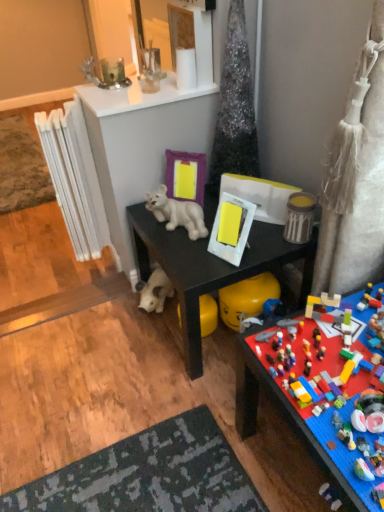
Question: In which direction should I rotate to look at sparkly silver christmas tree at upper center?

Choices:
 (A) left
 (B) right

Answer: (B)

Question: Does sparkly silver christmas tree at upper center have a greater width compared to metallic silver canister at upper right, positioned as the 4th toy in top-to-bottom order?

Choices:
 (A) no
 (B) yes

Answer: (B)

Question: Is sparkly silver christmas tree at upper center beside metallic silver canister at upper right, positioned as the 4th toy in top-to-bottom order?

Choices:
 (A) yes
 (B) no

Answer: (B)

Question: Can you confirm if sparkly silver christmas tree at upper center is positioned to the left of metallic silver canister at upper right, acting as the 3th toy starting from the bottom?

Choices:
 (A) no
 (B) yes

Answer: (B)

Question: Can you confirm if sparkly silver christmas tree at upper center is thinner than metallic silver canister at upper right, acting as the 3th toy starting from the bottom?

Choices:
 (A) no
 (B) yes

Answer: (A)

Question: Does sparkly silver christmas tree at upper center have a larger size compared to metallic silver canister at upper right, acting as the 3th toy starting from the bottom?

Choices:
 (A) no
 (B) yes

Answer: (B)

Question: From a real-world perspective, is sparkly silver christmas tree at upper center on metallic silver canister at upper right, positioned as the 4th toy in top-to-bottom order?

Choices:
 (A) no
 (B) yes

Answer: (B)

Question: Is multicolored plastic lego set at lower right, the 6th toy from the top, completely or partially outside of white glossy mirror at upper center?

Choices:
 (A) no
 (B) yes

Answer: (B)

Question: Is multicolored plastic lego set at lower right, which is counted as the first toy, starting from the bottom, to the right of white glossy mirror at upper center from the viewer's perspective?

Choices:
 (A) yes
 (B) no

Answer: (A)

Question: Is multicolored plastic lego set at lower right, which is counted as the first toy, starting from the bottom, to the left of white glossy mirror at upper center from the viewer's perspective?

Choices:
 (A) yes
 (B) no

Answer: (B)

Question: From the image's perspective, does multicolored plastic lego set at lower right, the 6th toy from the top, appear lower than white glossy mirror at upper center?

Choices:
 (A) yes
 (B) no

Answer: (A)

Question: Is multicolored plastic lego set at lower right, which is counted as the first toy, starting from the bottom, oriented towards white glossy mirror at upper center?

Choices:
 (A) no
 (B) yes

Answer: (A)

Question: Is multicolored plastic lego set at lower right, which is counted as the first toy, starting from the bottom, in contact with white glossy mirror at upper center?

Choices:
 (A) yes
 (B) no

Answer: (B)

Question: From a real-world perspective, is multicolored plastic lego set at lower right, which is counted as the first toy, starting from the bottom, positioned over white plastic radiator at left based on gravity?

Choices:
 (A) no
 (B) yes

Answer: (A)